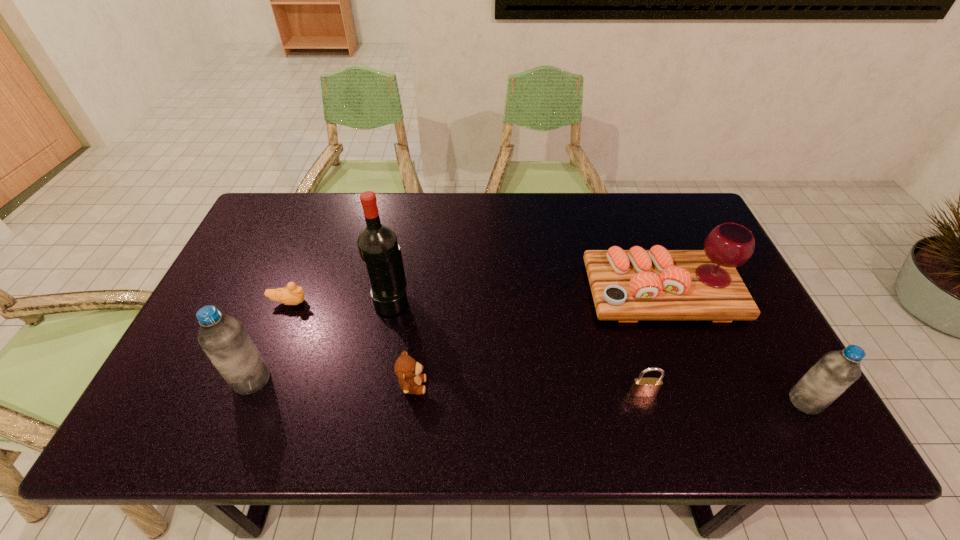
At what (x,y) coordinates should I click in order to perform the action: click on vacant space situated on the left of the right water bottle. Please return your answer as a coordinate pair (x, y). The height and width of the screenshot is (540, 960). Looking at the image, I should click on (707, 402).

Locate an element on the screen. vacant point located 0.120m on the face of the shortest object is located at coordinates (351, 302).

Image resolution: width=960 pixels, height=540 pixels. I want to click on vacant space located on the left of the platter, so click(x=458, y=291).

At what (x,y) coordinates should I click in order to perform the action: click on vacant space located 0.130m on the right of the tallest object. Please return your answer as a coordinate pair (x, y). This screenshot has width=960, height=540. Looking at the image, I should click on click(x=455, y=301).

This screenshot has width=960, height=540. Identify the location of vacant space located on the face of the fourth object from right to left. (x=465, y=386).

Locate an element on the screen. padlock present at the near edge is located at coordinates (643, 387).

Where is `teddy bear that is at the near edge`? The width and height of the screenshot is (960, 540). teddy bear that is at the near edge is located at coordinates (407, 369).

I want to click on water bottle that is at the left edge, so click(223, 338).

At what (x,y) coordinates should I click in order to perform the action: click on duckling that is at the left edge. Please return your answer as a coordinate pair (x, y). Looking at the image, I should click on (291, 295).

At what (x,y) coordinates should I click in order to perform the action: click on water bottle that is at the right edge. Please return your answer as a coordinate pair (x, y). Looking at the image, I should click on (835, 371).